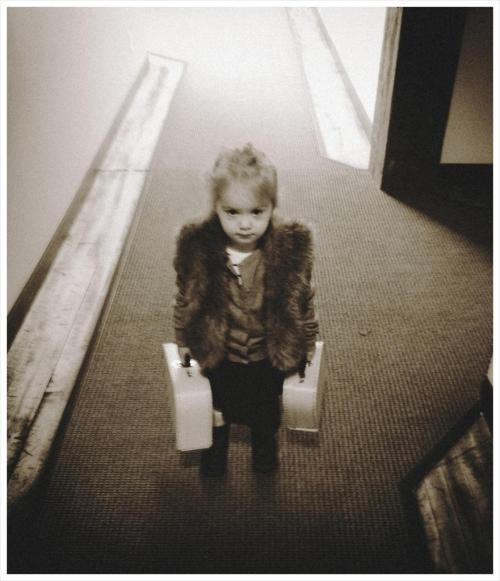
The height and width of the screenshot is (581, 500). I want to click on door frame, so click(x=416, y=99).